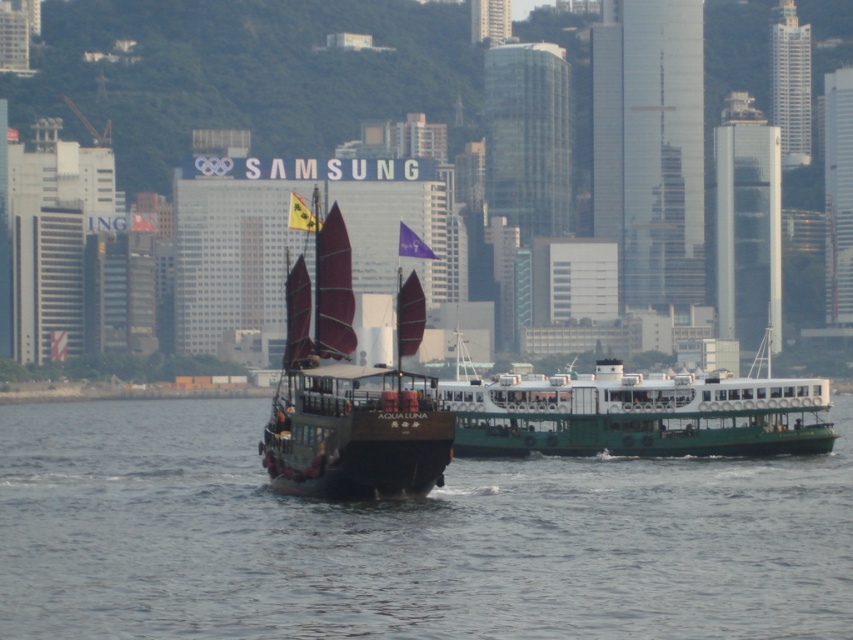
You are standing on the deck of the traditional junk boat named AQUA LUNA and want to observe two points in the scene. The first point is labeled as point (289,449) and the second is point (503,387). From your current position on the boat, which point appears closer to you?

Point (289,449) appears closer to you because it is positioned in front of point (503,387) in the scene.

You are a marine biologist observing the dark brown wooden sailboat at center and the green matte ferry at center. Which vessel would require less space to dock, and why?

The dark brown wooden sailboat at center requires less space to dock because it is smaller than the green matte ferry at center.

You are a sailor planning to dock your boat at the waterfront. You notice the smooth water at center and the dark brown wooden sailboat at center. Which one is closer to the water surface?

The smooth water at center is not as tall as the dark brown wooden sailboat at center, so the smooth water at center is closer to the water surface.